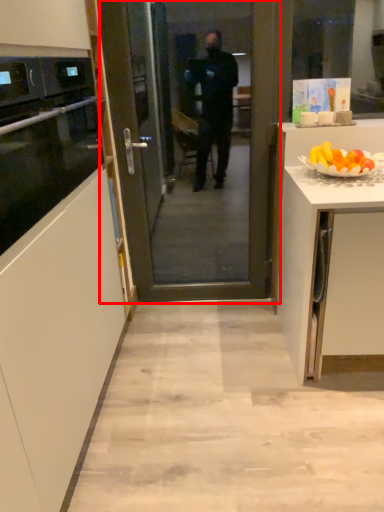
Question: Where is screen door (annotated by the red box) located in relation to oven in the image?

Choices:
 (A) left
 (B) right

Answer: (B)